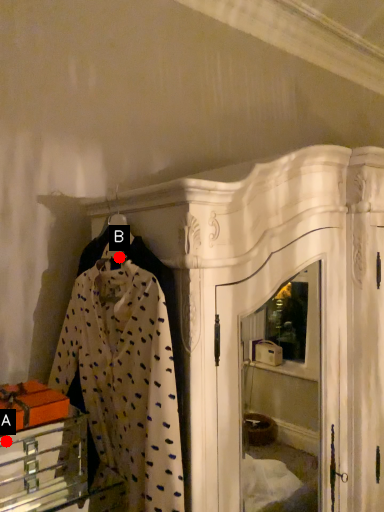
Question: Two points are circled on the image, labeled by A and B beside each circle. Which point is closer to the camera taking this photo?

Choices:
 (A) A is closer
 (B) B is closer

Answer: (A)